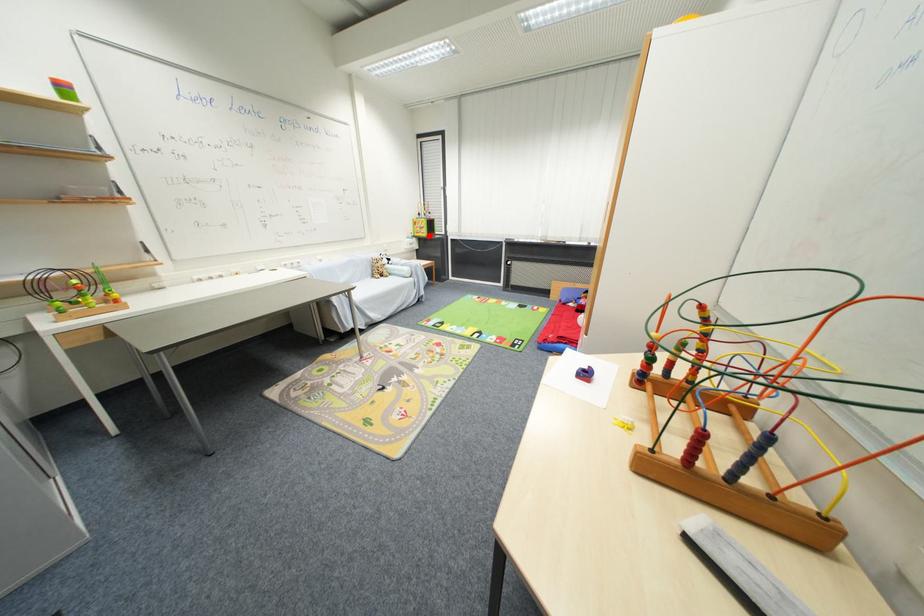
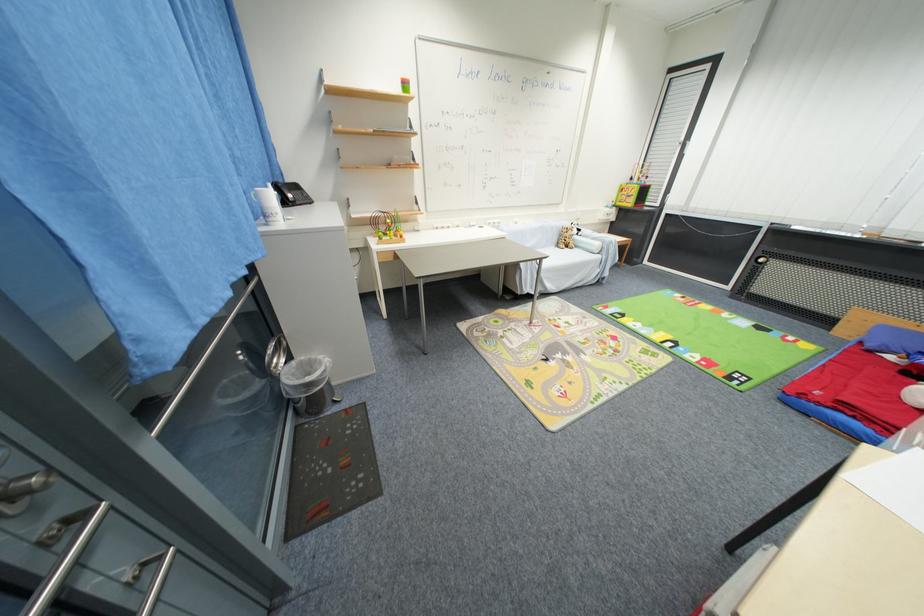
In the second image, find the point that corresponds to the highlighted location in the first image.

(635, 206)